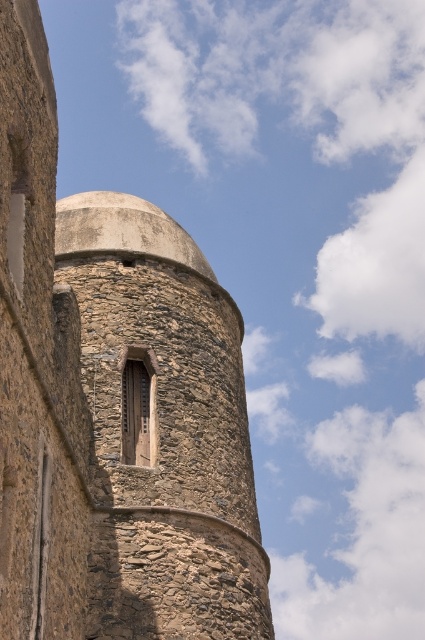
You are standing in front of the rustic stone tower at center and the stone textured window at center. Which object is positioned to the left of the other?

The rustic stone tower at center is positioned to the left of the stone textured window at center.

You are standing at the base of the stone tower and notice two points marked on the tower wall. The first point is at coordinates point (198, 275) and the second is at point (155, 365). Which point is farther from your current position?

Point (198, 275) is behind point (155, 365), so the first point is farther from your current position.

Consider the image. You are an architect inspecting the stone structure. You notice the rustic stone tower at center and the stone textured window at center. Which object is significantly taller?

The rustic stone tower at center is much taller than the stone textured window at center.